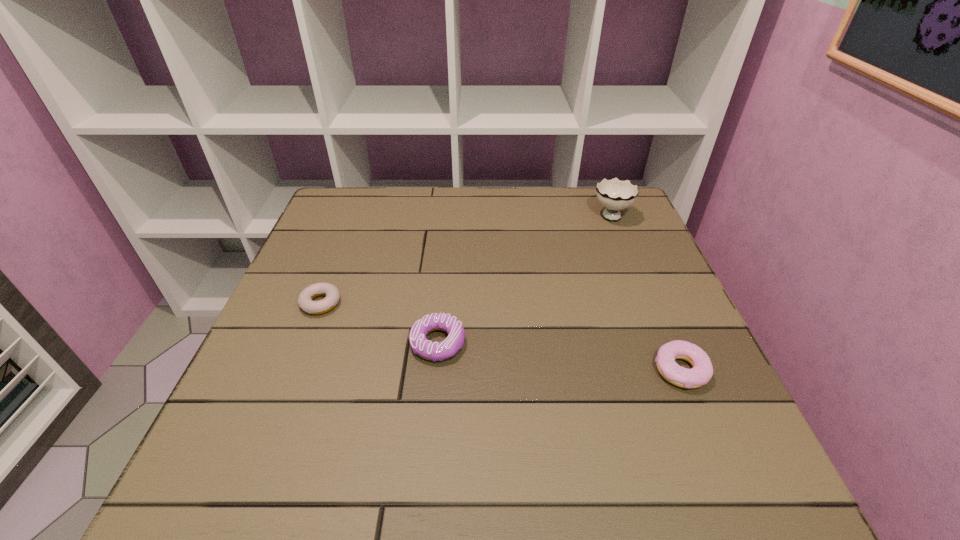
Locate an element on the screen. This screenshot has height=540, width=960. the tallest object is located at coordinates 614,194.

Identify the location of the farthest object. The height and width of the screenshot is (540, 960). (614, 194).

This screenshot has width=960, height=540. I want to click on the second doughnut from right to left, so click(433, 351).

What are the coordinates of `the rightmost doughnut` in the screenshot? It's located at (701, 373).

The width and height of the screenshot is (960, 540). Find the location of `the leftmost doughnut`. the leftmost doughnut is located at coordinates (332, 294).

I want to click on the shortest object, so click(332, 294).

Identify the location of vacant region located 0.050m on the side of the tallest object with the handle. (601, 192).

The height and width of the screenshot is (540, 960). Identify the location of free space located 0.070m on the side of the tallest object with the handle. (600, 188).

Find the location of `free region located on the back of the second doughnut from left to right`. free region located on the back of the second doughnut from left to right is located at coordinates (448, 226).

Where is `vacant space located on the front of the rightmost doughnut`? Image resolution: width=960 pixels, height=540 pixels. vacant space located on the front of the rightmost doughnut is located at coordinates (731, 488).